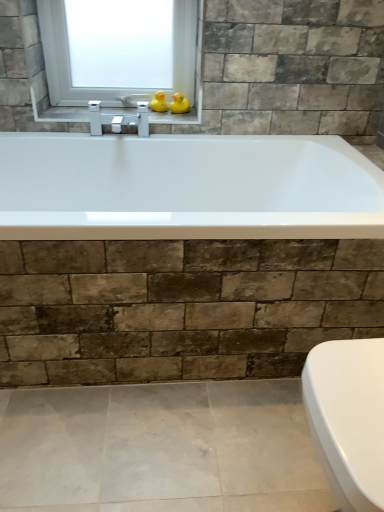
Question: From a real-world perspective, is transparent glass window at upper center on top of metallic silver faucet at upper center?

Choices:
 (A) no
 (B) yes

Answer: (B)

Question: Are transparent glass window at upper center and metallic silver faucet at upper center making contact?

Choices:
 (A) no
 (B) yes

Answer: (A)

Question: Can you confirm if transparent glass window at upper center is shorter than metallic silver faucet at upper center?

Choices:
 (A) no
 (B) yes

Answer: (A)

Question: Is transparent glass window at upper center turned away from metallic silver faucet at upper center?

Choices:
 (A) yes
 (B) no

Answer: (B)

Question: Can metallic silver faucet at upper center be found inside transparent glass window at upper center?

Choices:
 (A) yes
 (B) no

Answer: (B)

Question: Visually, is yellow rubber duck at upper center, which is counted as the second duck, starting from the left, positioned to the left or to the right of transparent glass window at upper center?

Choices:
 (A) left
 (B) right

Answer: (B)

Question: Is yellow rubber duck at upper center, which is counted as the second duck, starting from the left, inside or outside of transparent glass window at upper center?

Choices:
 (A) inside
 (B) outside

Answer: (B)

Question: Looking at their shapes, would you say yellow rubber duck at upper center, positioned as the 1th duck in right-to-left order, is wider or thinner than transparent glass window at upper center?

Choices:
 (A) wide
 (B) thin

Answer: (B)

Question: From a real-world perspective, is yellow rubber duck at upper center, positioned as the 1th duck in right-to-left order, above or below transparent glass window at upper center?

Choices:
 (A) below
 (B) above

Answer: (A)

Question: Considering the positions of rubber duck at upper center, which is the second duck in right-to-left order, and transparent glass window at upper center in the image, is rubber duck at upper center, which is the second duck in right-to-left order, bigger or smaller than transparent glass window at upper center?

Choices:
 (A) small
 (B) big

Answer: (A)

Question: In the image, is rubber duck at upper center, which is the second duck in right-to-left order, on the left side or the right side of transparent glass window at upper center?

Choices:
 (A) right
 (B) left

Answer: (A)

Question: Considering their positions, is rubber duck at upper center, which is the second duck in right-to-left order, located in front of or behind transparent glass window at upper center?

Choices:
 (A) behind
 (B) front

Answer: (A)

Question: From the image's perspective, relative to transparent glass window at upper center, is rubber duck at upper center, the first duck in the left-to-right sequence, above or below?

Choices:
 (A) above
 (B) below

Answer: (B)

Question: From their relative heights in the image, would you say yellow rubber duck at upper center, positioned as the 1th duck in right-to-left order, is taller or shorter than metallic silver faucet at upper center?

Choices:
 (A) short
 (B) tall

Answer: (B)

Question: Considering the relative positions of yellow rubber duck at upper center, which is counted as the second duck, starting from the left, and metallic silver faucet at upper center in the image provided, is yellow rubber duck at upper center, which is counted as the second duck, starting from the left, to the left or to the right of metallic silver faucet at upper center?

Choices:
 (A) left
 (B) right

Answer: (B)